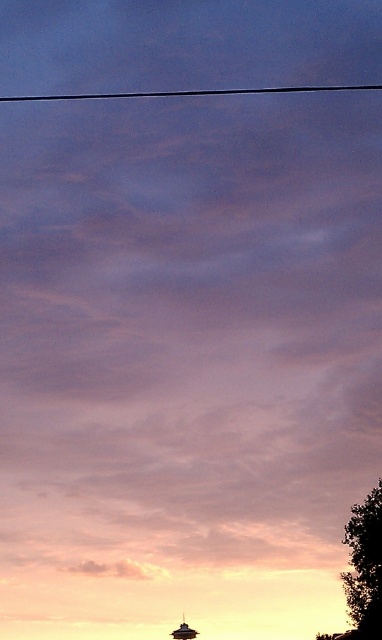
Question: Does black wire at upper center have a greater width compared to metallic silver boat at lower center?

Choices:
 (A) yes
 (B) no

Answer: (A)

Question: Considering the real-world distances, which object is closest to the metallic silver boat at lower center?

Choices:
 (A) green leafy tree at right
 (B) black wire at upper center

Answer: (A)

Question: Is green leafy tree at right above metallic silver boat at lower center?

Choices:
 (A) yes
 (B) no

Answer: (A)

Question: Estimate the real-world distances between objects in this image. Which object is closer to the green leafy tree at right?

Choices:
 (A) black wire at upper center
 (B) metallic silver boat at lower center

Answer: (B)

Question: Does green leafy tree at right appear on the left side of metallic silver boat at lower center?

Choices:
 (A) yes
 (B) no

Answer: (B)

Question: Which object appears closest to the camera in this image?

Choices:
 (A) black wire at upper center
 (B) green leafy tree at right

Answer: (B)